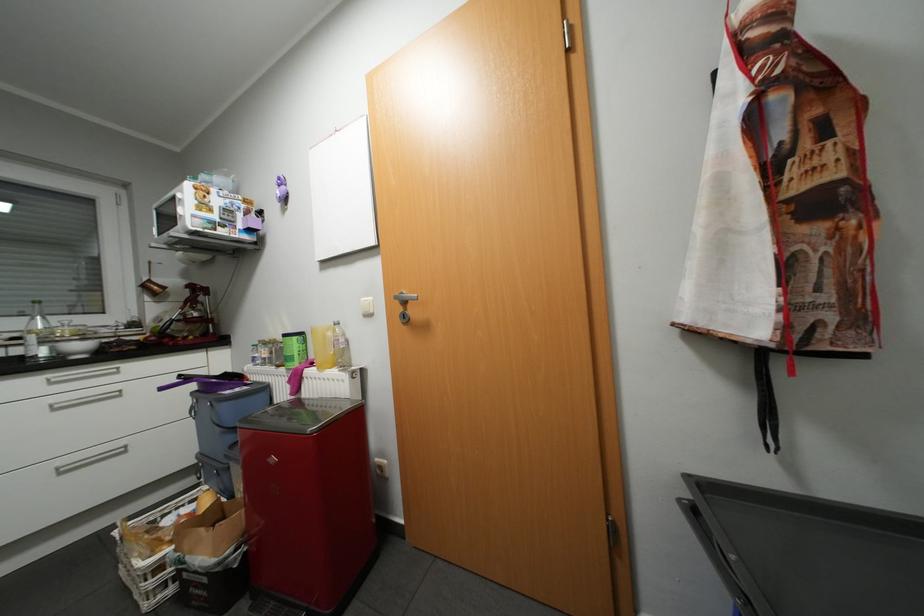
Where would you lift the yellow plastic bottle? Please return your answer as a coordinate pair (x, y).

(322, 346)